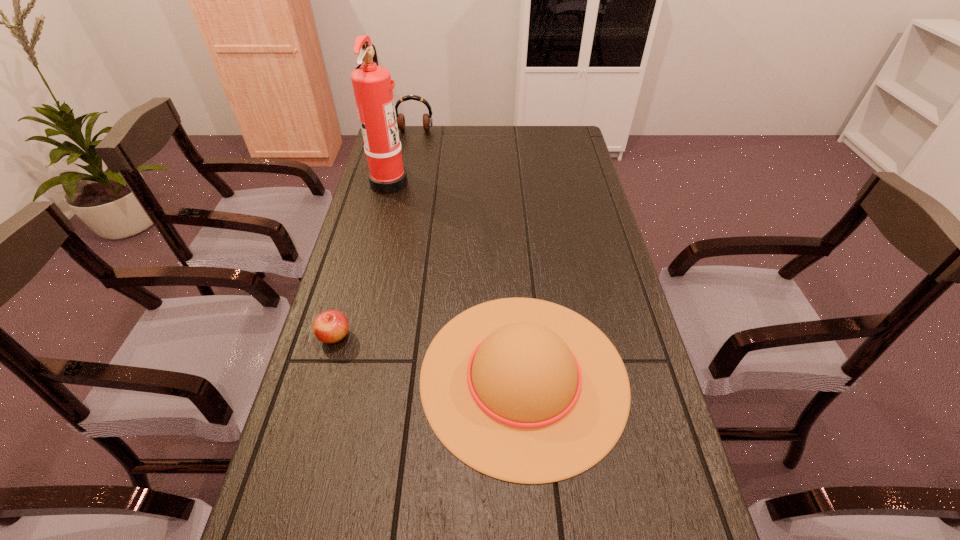
Image resolution: width=960 pixels, height=540 pixels. In order to click on vacant space at the far left corner of the desktop in this screenshot , I will do `click(402, 132)`.

Find the location of a particular element. This screenshot has height=540, width=960. vacant area at the far right corner of the desktop is located at coordinates (568, 135).

The width and height of the screenshot is (960, 540). Identify the location of vacant area that lies between the third nearest object and the apple. (362, 259).

Find the location of a particular element. This screenshot has height=540, width=960. unoccupied position between the tallest object and the third tallest object is located at coordinates (457, 279).

The image size is (960, 540). In order to click on free space between the fire extinguisher and the apple in this screenshot , I will do `click(362, 259)`.

Find the location of a particular element. vacant region between the apple and the tallest object is located at coordinates (362, 259).

The width and height of the screenshot is (960, 540). In order to click on free space between the fire extinguisher and the shortest object in this screenshot , I will do `click(362, 259)`.

This screenshot has width=960, height=540. I want to click on free space that is in between the apple and the second farthest object, so click(362, 259).

Locate which object is the third closest to the tallest object. Please provide its 2D coordinates. Your answer should be formatted as a tuple, i.e. [(x, y)], where the tuple contains the x and y coordinates of a point satisfying the conditions above.

[(331, 326)]

You are a GUI agent. You are given a task and a screenshot of the screen. Output one action in this format:
    pyautogui.click(x=<x>, y=<y>)
    Task: Click on the object that is the third nearest to the tallest object
    
    Given the screenshot: What is the action you would take?
    pyautogui.click(x=331, y=326)